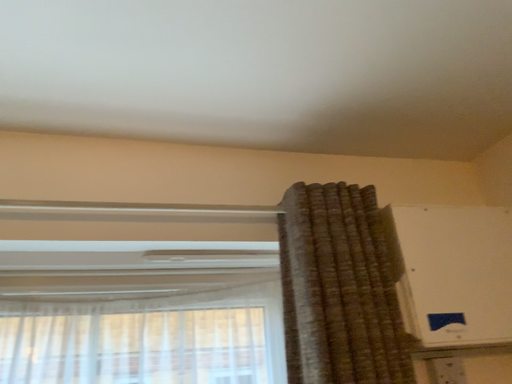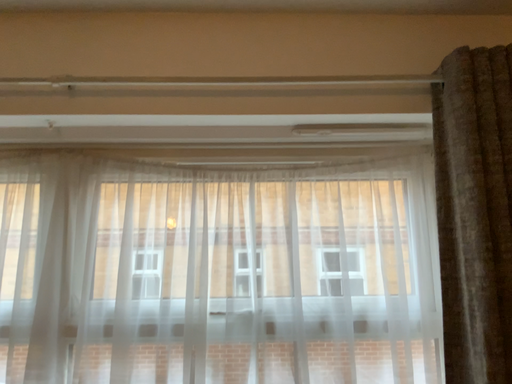
Question: How did the camera likely rotate when shooting the video?

Choices:
 (A) rotated downward
 (B) rotated upward

Answer: (A)